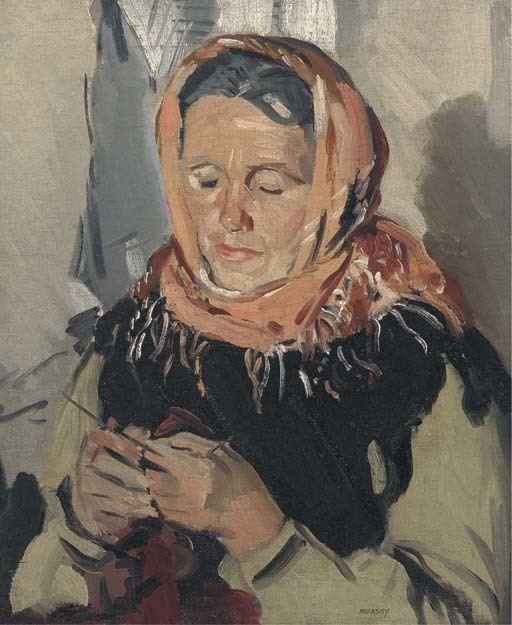
Locate an element on the screen. The image size is (512, 625). wall is located at coordinates (64, 109), (403, 78).